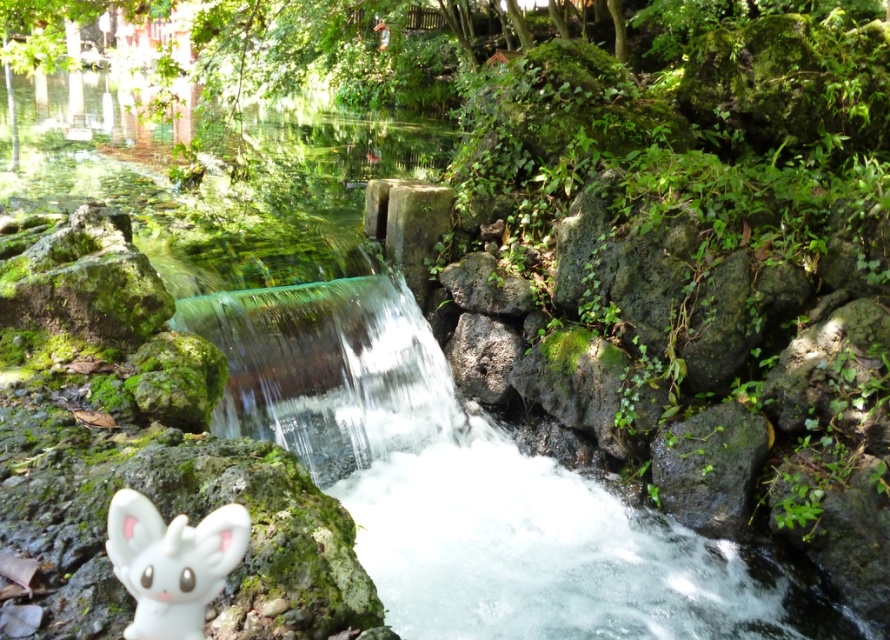
Question: Among these points, which one is farthest from the camera?

Choices:
 (A) (761, 445)
 (B) (107, 554)

Answer: (A)

Question: Does white matte plush at lower left appear on the left side of green mossy rock at center-right?

Choices:
 (A) no
 (B) yes

Answer: (B)

Question: Can you confirm if white matte plush at lower left is positioned to the left of green mossy rock at center-right?

Choices:
 (A) no
 (B) yes

Answer: (B)

Question: Can you confirm if white matte plush at lower left is wider than green mossy rock at center-right?

Choices:
 (A) yes
 (B) no

Answer: (B)

Question: Which point appears farthest from the camera in this image?

Choices:
 (A) (236, 522)
 (B) (684, 500)

Answer: (B)